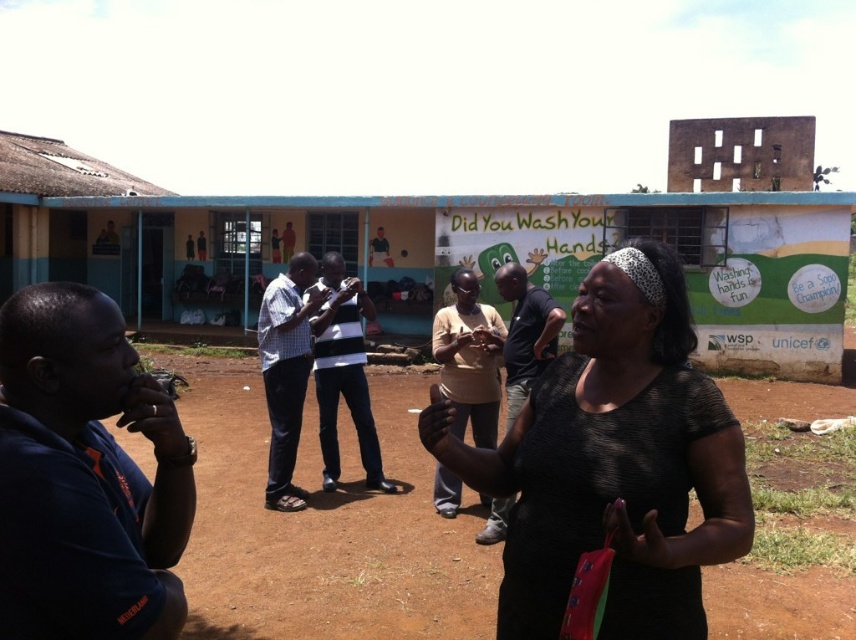
You are standing in the outdoor rural scene near the group of people. You need to locate the textured black shirt at center and the dark blue shirt at left. Which one is higher up in the image?

The textured black shirt at center is located above the dark blue shirt at left, so the textured black shirt at center is higher up in the image.

From the picture: You are organizing a group photo and need to arrange two people side by side. The textured black shirt at center and the dark blue shirt at left are candidates. Can you determine if there is enough space between them to fit both comfortably?

The textured black shirt at center might be wider than dark blue shirt at left, so there may not be enough space between them to fit both comfortably without overlapping.

Looking at this image, you are standing in the outdoor scene described. There is a brown dirt field at center and a light brown cotton shirt at center. Which object is closer to you?

The brown dirt field at center is closer to you because it is in front of the light brown cotton shirt at center.